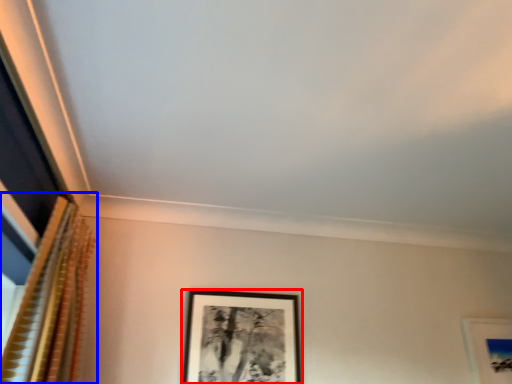
Question: Which object appears farthest to the camera in this image, picture frame (highlighted by a red box) or curtain (highlighted by a blue box)?

Choices:
 (A) picture frame
 (B) curtain

Answer: (A)